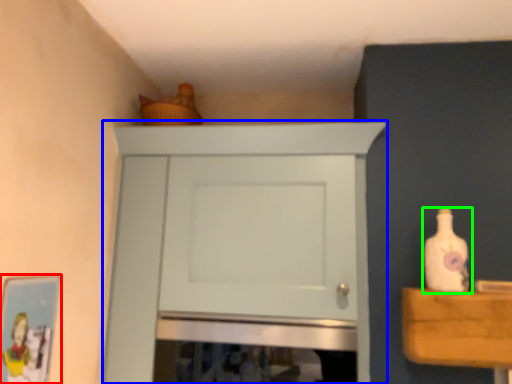
Question: Based on their relative distances, which object is nearer to picture frame (highlighted by a red box)? Choose from cupboard (highlighted by a blue box) and bottle (highlighted by a green box).

Choices:
 (A) cupboard
 (B) bottle

Answer: (A)